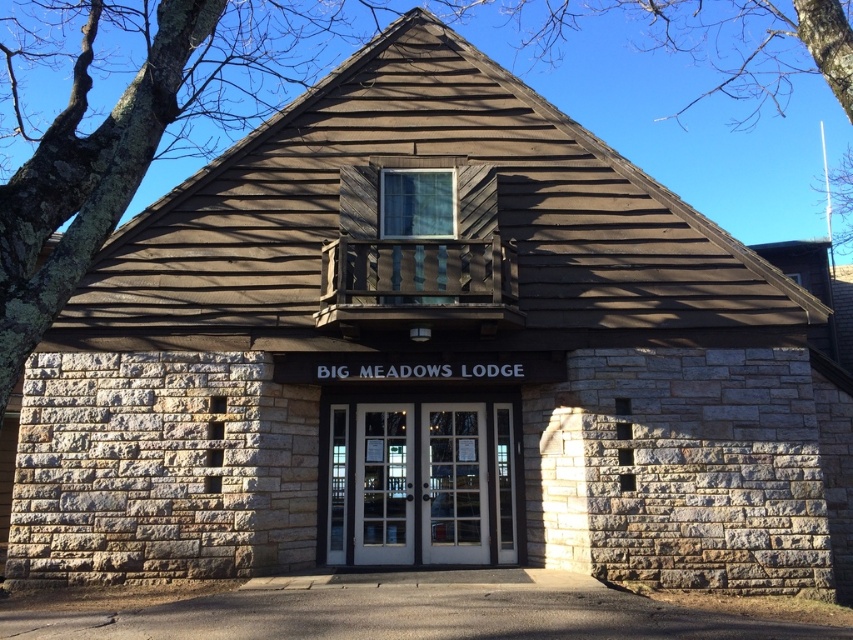
Question: Does brown wood tree at upper center have a greater width compared to white glass door at center?

Choices:
 (A) yes
 (B) no

Answer: (A)

Question: Which object is farther from the camera taking this photo?

Choices:
 (A) brown wood tree at upper center
 (B) white glass door at center

Answer: (B)

Question: Which of the following is the closest to the observer?

Choices:
 (A) (636, 8)
 (B) (331, 561)

Answer: (B)

Question: Does brown wood tree at upper center appear under white glass door at center?

Choices:
 (A) yes
 (B) no

Answer: (B)

Question: Is brown wood tree at upper center below white glass door at center?

Choices:
 (A) no
 (B) yes

Answer: (A)

Question: Which object is closer to the camera taking this photo?

Choices:
 (A) white glass door at center
 (B) brown wood tree at upper center

Answer: (B)